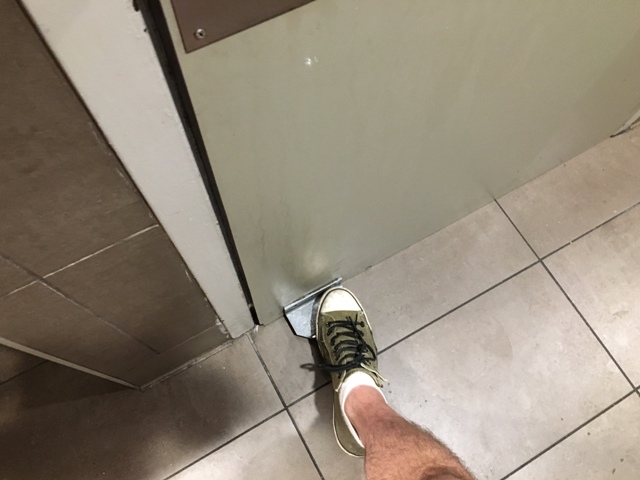
I want to click on sock, so click(x=358, y=377).